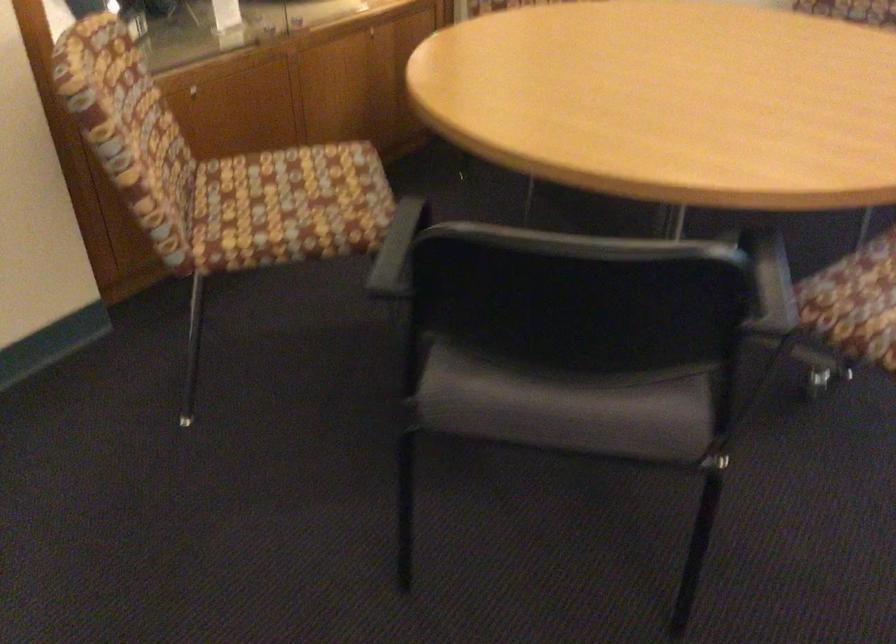
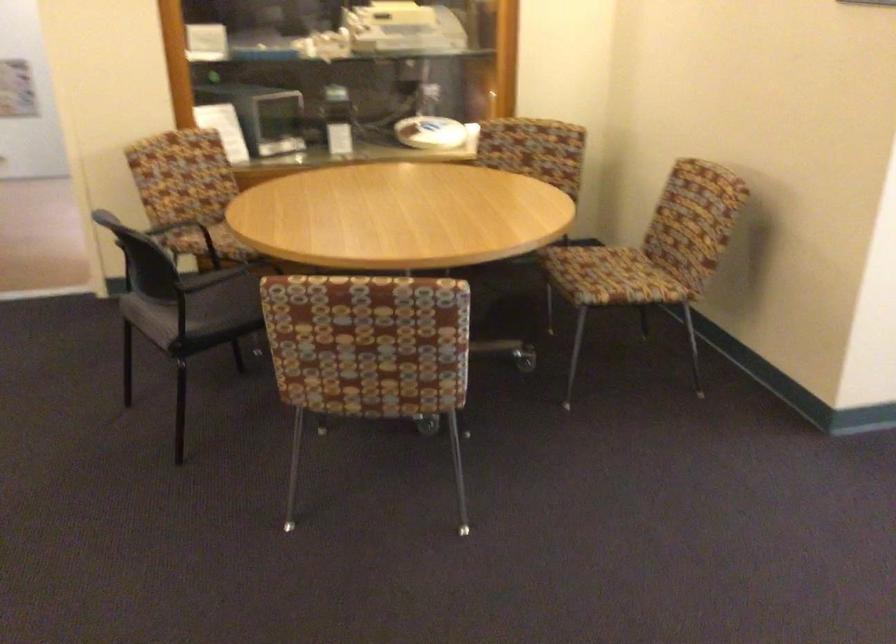
Where in the second image is the point corresponding to point (188, 221) from the first image?

(167, 220)